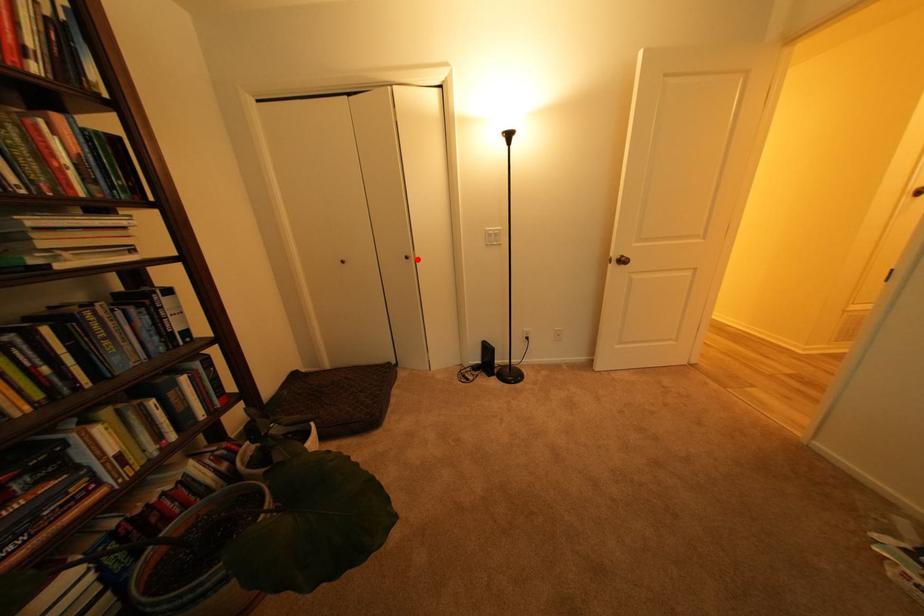
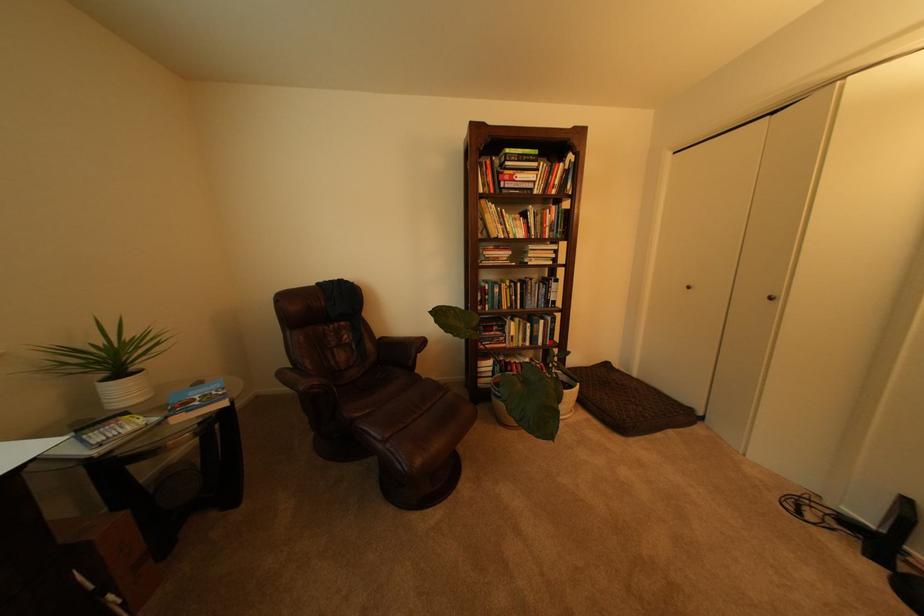
Locate, in the second image, the point that corresponds to the highlighted location in the first image.

(782, 300)